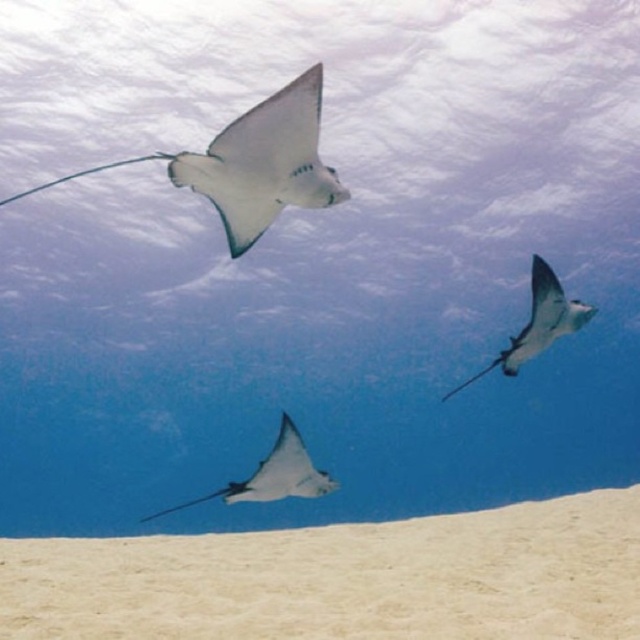
You are a marine biologist observing an underwater scene. You notice the white sandy bottom at lower center and the translucent white stingray at upper center. Which object appears larger in the image?

The white sandy bottom at lower center is bigger than the translucent white stingray at upper right, so the white sandy bottom at lower center appears larger in the image.

You are a marine biologist observing the underwater scene. You notice the white sandy bottom at lower center. Based on its coordinates, can you determine if it is positioned closer to the top or bottom of the image?

The white sandy bottom at lower center is located at point (342,579). Since the y coordinate is 0.537, which is closer to 1.0 than 0.0, it is positioned closer to the bottom of the image.

You are a marine biologist observing the underwater scene. You notice the white sandy bottom at lower center and the translucent white stingray at upper center. Which object is positioned lower in the image?

The white sandy bottom at lower center is positioned lower than the translucent white stingray at upper center.